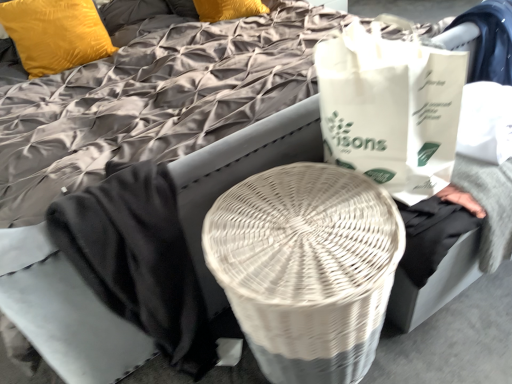
You are a GUI agent. You are given a task and a screenshot of the screen. Output one action in this format:
    pyautogui.click(x=<x>, y=<y>)
    Task: Click on the white wicker basket at center
    The height and width of the screenshot is (384, 512).
    Given the screenshot: What is the action you would take?
    pyautogui.click(x=306, y=268)

Image resolution: width=512 pixels, height=384 pixels. Identify the location of white paper grocery bag at right. (390, 109).

At what (x,y) coordinates should I click in order to perform the action: click on white wicker basket at center. Please return your answer as a coordinate pair (x, y). Looking at the image, I should click on (306, 268).

Which of these two, white wicker basket at center or white paper grocery bag at right, stands taller?

Standing taller between the two is white wicker basket at center.

Would you say white wicker basket at center is a long distance from white paper grocery bag at right?

No, white wicker basket at center is not far from white paper grocery bag at right.

Does point (357, 370) come farther from viewer compared to point (410, 203)?

Yes, it is.

From the image's perspective, would you say white wicker basket at center is positioned over white paper grocery bag at right?

Incorrect, from the image's perspective, white wicker basket at center is lower than white paper grocery bag at right.

Image resolution: width=512 pixels, height=384 pixels. What are the coordinates of `pillow on the left of white paper grocery bag at right` in the screenshot? It's located at (55, 34).

From a real-world perspective, is white paper grocery bag at right positioned under velvet yellow pillow at upper left based on gravity?

No, from a real-world perspective, white paper grocery bag at right is not beneath velvet yellow pillow at upper left.

Consider the image. Is white paper grocery bag at right aimed at velvet yellow pillow at upper left?

No, white paper grocery bag at right does not turn towards velvet yellow pillow at upper left.

From the image's perspective, which object appears higher, white paper grocery bag at right or velvet yellow pillow at upper left?

velvet yellow pillow at upper left.

Considering the relative positions of white paper grocery bag at right and white wicker basket at center in the image provided, is white paper grocery bag at right to the right of white wicker basket at center from the viewer's perspective?

Yes.

Is white paper grocery bag at right not inside white wicker basket at center?

Yes, white paper grocery bag at right is not within white wicker basket at center.

Is white paper grocery bag at right not close to white wicker basket at center?

No, white paper grocery bag at right is in close proximity to white wicker basket at center.

Is white wicker basket at center inside velvet yellow pillow at upper left?

No, white wicker basket at center is not a part of velvet yellow pillow at upper left.

Does velvet yellow pillow at upper left come in front of white wicker basket at center?

No, the depth of velvet yellow pillow at upper left is greater than that of white wicker basket at center.

Who is shorter, velvet yellow pillow at upper left or white wicker basket at center?

With less height is velvet yellow pillow at upper left.

From a real-world perspective, which is physically above, velvet yellow pillow at upper left or white wicker basket at center?

velvet yellow pillow at upper left is physically above.

Consider the image. Which of these two, white wicker basket at center or velvet yellow pillow at upper left, stands taller?

Standing taller between the two is white wicker basket at center.

Which object is closer to the camera taking this photo, white wicker basket at center or velvet yellow pillow at upper left?

white wicker basket at center is closer to the camera.

Based on the photo, which object is positioned more to the right, white wicker basket at center or velvet yellow pillow at upper left?

white wicker basket at center is more to the right.

Who is shorter, velvet yellow pillow at upper left or white paper grocery bag at right?

With less height is velvet yellow pillow at upper left.

From the image's perspective, is velvet yellow pillow at upper left beneath white paper grocery bag at right?

No, from the image's perspective, velvet yellow pillow at upper left is not beneath white paper grocery bag at right.

Is velvet yellow pillow at upper left to the left of white paper grocery bag at right from the viewer's perspective?

Correct, you'll find velvet yellow pillow at upper left to the left of white paper grocery bag at right.

Identify the location of round table directly beneath the white paper grocery bag at right (from a real-world perspective). (306, 268).

In order to click on grocery bag below the velvet yellow pillow at upper left (from the image's perspective) in this screenshot , I will do `click(390, 109)`.

When comparing their distances from white paper grocery bag at right, does white wicker basket at center or velvet yellow pillow at upper left seem further?

velvet yellow pillow at upper left is positioned further to the anchor white paper grocery bag at right.

From the picture: From the image, which object appears to be farther from white wicker basket at center, velvet yellow pillow at upper left or white paper grocery bag at right?

velvet yellow pillow at upper left is positioned further to the anchor white wicker basket at center.

Estimate the real-world distances between objects in this image. Which object is closer to velvet yellow pillow at upper left, white wicker basket at center or white paper grocery bag at right?

white paper grocery bag at right is positioned closer to the anchor velvet yellow pillow at upper left.

Looking at the image, which one is located further to white paper grocery bag at right, velvet yellow pillow at upper left or white wicker basket at center?

velvet yellow pillow at upper left is positioned further to the anchor white paper grocery bag at right.

Looking at the image, which one is located further to white wicker basket at center, white paper grocery bag at right or velvet yellow pillow at upper left?

Based on the image, velvet yellow pillow at upper left appears to be further to white wicker basket at center.

Considering their positions, is white paper grocery bag at right positioned further to velvet yellow pillow at upper left than white wicker basket at center?

Based on the image, white wicker basket at center appears to be further to velvet yellow pillow at upper left.

The width and height of the screenshot is (512, 384). Find the location of `round table located between velvet yellow pillow at upper left and white paper grocery bag at right in the left-right direction`. round table located between velvet yellow pillow at upper left and white paper grocery bag at right in the left-right direction is located at coordinates (306, 268).